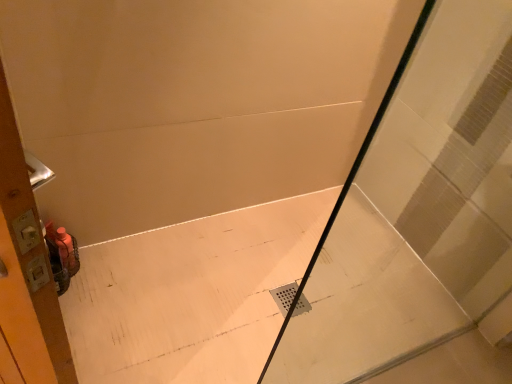
Find the location of a particular element. The image size is (512, 384). unoccupied space behind transparent glass door at center is located at coordinates (371, 301).